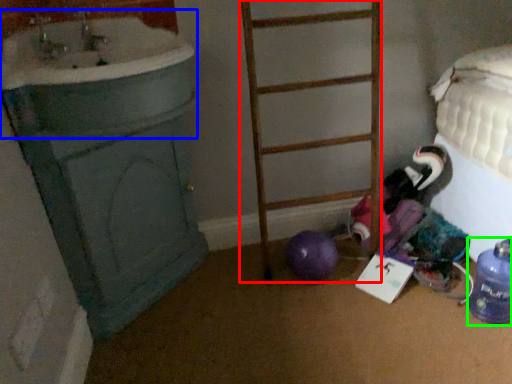
Question: Which object is positioned closest to ladder (highlighted by a red box)? Select from sink (highlighted by a blue box) and bottle (highlighted by a green box).

Choices:
 (A) sink
 (B) bottle

Answer: (A)